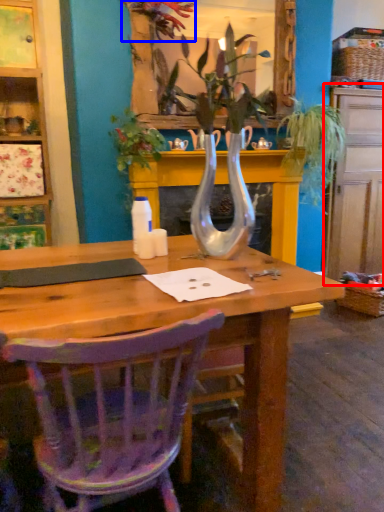
Question: Which object is further to the camera taking this photo, dresser (highlighted by a red box) or flower (highlighted by a blue box)?

Choices:
 (A) dresser
 (B) flower

Answer: (A)